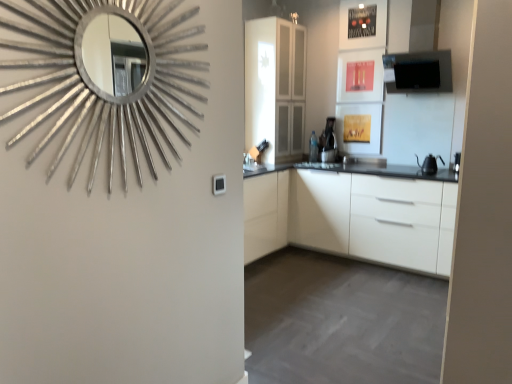
Question: From a real-world perspective, does white glossy sink at center sit lower than silver metallic mirror at upper left?

Choices:
 (A) no
 (B) yes

Answer: (B)

Question: From the image's perspective, would you say white glossy sink at center is shown under silver metallic mirror at upper left?

Choices:
 (A) no
 (B) yes

Answer: (A)

Question: Is white glossy sink at center taller than silver metallic mirror at upper left?

Choices:
 (A) yes
 (B) no

Answer: (B)

Question: Does white glossy sink at center come behind silver metallic mirror at upper left?

Choices:
 (A) no
 (B) yes

Answer: (B)

Question: From a real-world perspective, is white glossy sink at center on top of silver metallic mirror at upper left?

Choices:
 (A) no
 (B) yes

Answer: (A)

Question: Considering the positions of black matte exhaust hood at upper right and black matte kettle at right in the image, is black matte exhaust hood at upper right wider or thinner than black matte kettle at right?

Choices:
 (A) thin
 (B) wide

Answer: (B)

Question: Is black matte exhaust hood at upper right spatially inside black matte kettle at right, or outside of it?

Choices:
 (A) outside
 (B) inside

Answer: (A)

Question: From the image's perspective, is black matte exhaust hood at upper right above or below black matte kettle at right?

Choices:
 (A) below
 (B) above

Answer: (B)

Question: Looking at the image, does black matte exhaust hood at upper right seem bigger or smaller compared to black matte kettle at right?

Choices:
 (A) small
 (B) big

Answer: (B)

Question: Is point (293, 205) positioned closer to the camera than point (254, 155)?

Choices:
 (A) farther
 (B) closer

Answer: (B)

Question: Is white matte cabinet at center wider or thinner than white glossy sink at center?

Choices:
 (A) thin
 (B) wide

Answer: (B)

Question: Considering their positions, is white matte cabinet at center located in front of or behind white glossy sink at center?

Choices:
 (A) behind
 (B) front

Answer: (B)

Question: Is white matte cabinet at center spatially inside white glossy sink at center, or outside of it?

Choices:
 (A) inside
 (B) outside

Answer: (B)

Question: Is point (261, 167) positioned closer to the camera than point (437, 69)?

Choices:
 (A) closer
 (B) farther

Answer: (B)

Question: Considering the relative positions of white glossy sink at center and black matte exhaust hood at upper right in the image provided, is white glossy sink at center to the left or to the right of black matte exhaust hood at upper right?

Choices:
 (A) left
 (B) right

Answer: (A)